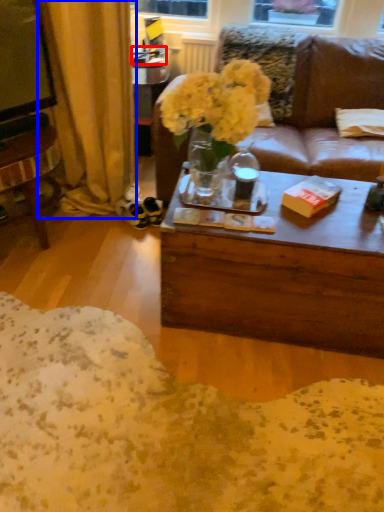
Question: Which object appears farthest to the camera in this image, box (highlighted by a red box) or curtain (highlighted by a blue box)?

Choices:
 (A) box
 (B) curtain

Answer: (A)